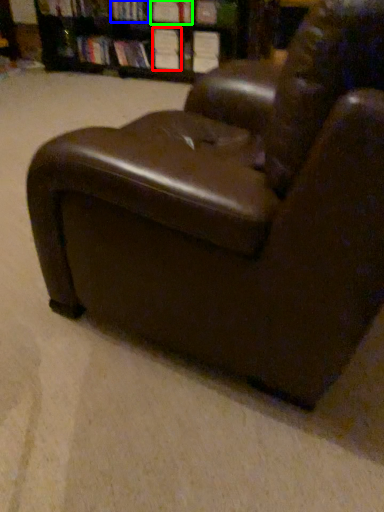
Question: Which object is positioned closest to book (highlighted by a red box)? Select from book (highlighted by a blue box) and book (highlighted by a green box).

Choices:
 (A) book
 (B) book

Answer: (B)